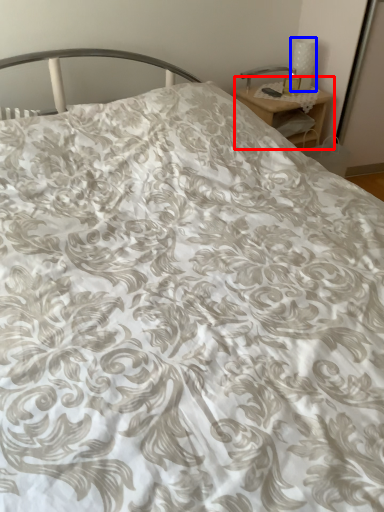
Question: Which point is closer to the camera, nightstand (highlighted by a red box) or table lamp (highlighted by a blue box)?

Choices:
 (A) nightstand
 (B) table lamp

Answer: (A)